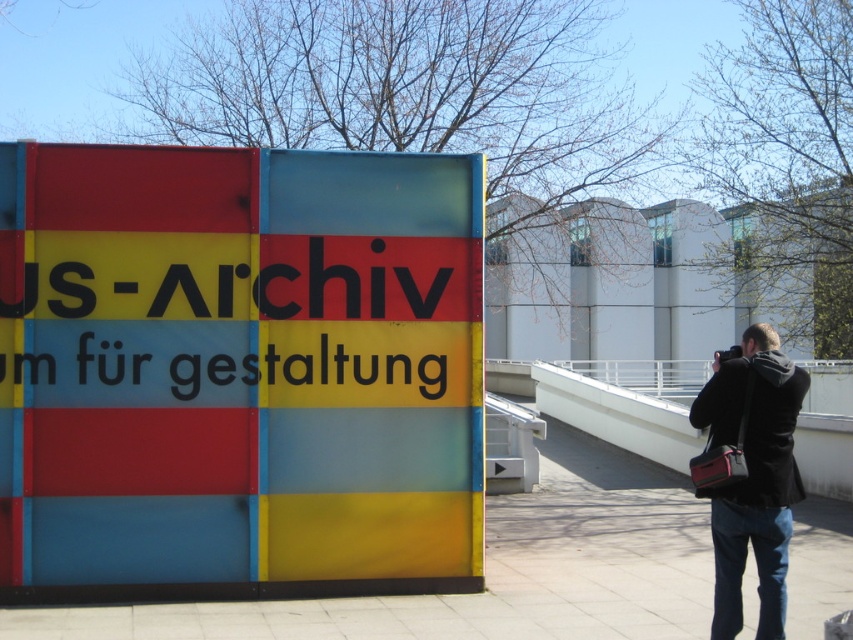
Does matte plastic sign at center appear under black fabric camera bag at lower right?

No, matte plastic sign at center is not below black fabric camera bag at lower right.

What do you see at coordinates (238, 372) in the screenshot?
I see `matte plastic sign at center` at bounding box center [238, 372].

Where is `matte plastic sign at center`? This screenshot has width=853, height=640. matte plastic sign at center is located at coordinates (238, 372).